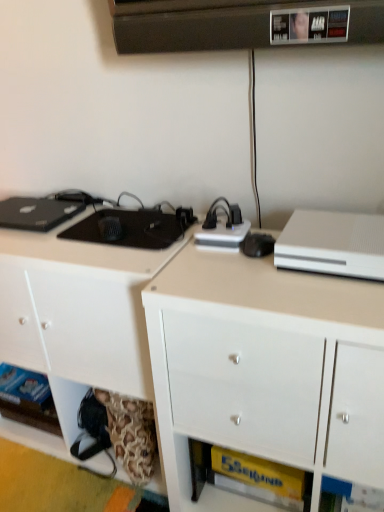
Question: Which direction should I rotate to face white glossy cabinet at center, marked as the first cabinetry in a right-to-left arrangement, — up or down?

Choices:
 (A) up
 (B) down

Answer: (B)

Question: Can you confirm if white matte cabinet at lower left, the 2th cabinetry positioned from the right, is wider than white matte desktop computer at upper right?

Choices:
 (A) no
 (B) yes

Answer: (B)

Question: From a real-world perspective, is white matte cabinet at lower left, the 2th cabinetry positioned from the right, beneath white matte desktop computer at upper right?

Choices:
 (A) no
 (B) yes

Answer: (B)

Question: Does white matte cabinet at lower left, the 2th cabinetry positioned from the right, lie in front of white matte desktop computer at upper right?

Choices:
 (A) no
 (B) yes

Answer: (A)

Question: Is white matte cabinet at lower left, the 2th cabinetry positioned from the right, taller than white matte desktop computer at upper right?

Choices:
 (A) yes
 (B) no

Answer: (A)

Question: Does white matte cabinet at lower left, which ranks as the first cabinetry in left-to-right order, turn towards white matte desktop computer at upper right?

Choices:
 (A) no
 (B) yes

Answer: (A)

Question: Is white matte cabinet at lower left, which ranks as the first cabinetry in left-to-right order, touching white matte desktop computer at upper right?

Choices:
 (A) yes
 (B) no

Answer: (B)

Question: Does white glossy cabinet at center, marked as the first cabinetry in a right-to-left arrangement, have a smaller size compared to white matte cabinet at lower left, which ranks as the first cabinetry in left-to-right order?

Choices:
 (A) yes
 (B) no

Answer: (A)

Question: Is white glossy cabinet at center, placed as the second cabinetry when sorted from left to right, oriented away from white matte cabinet at lower left, the 2th cabinetry positioned from the right?

Choices:
 (A) no
 (B) yes

Answer: (A)

Question: Is white glossy cabinet at center, placed as the second cabinetry when sorted from left to right, shorter than white matte cabinet at lower left, which ranks as the first cabinetry in left-to-right order?

Choices:
 (A) no
 (B) yes

Answer: (A)

Question: Is white glossy cabinet at center, marked as the first cabinetry in a right-to-left arrangement, not near white matte cabinet at lower left, which ranks as the first cabinetry in left-to-right order?

Choices:
 (A) no
 (B) yes

Answer: (A)

Question: Is white glossy cabinet at center, placed as the second cabinetry when sorted from left to right, to the right of white matte cabinet at lower left, which ranks as the first cabinetry in left-to-right order, from the viewer's perspective?

Choices:
 (A) no
 (B) yes

Answer: (B)

Question: Is white glossy cabinet at center, placed as the second cabinetry when sorted from left to right, positioned behind white matte cabinet at lower left, the 2th cabinetry positioned from the right?

Choices:
 (A) no
 (B) yes

Answer: (A)

Question: Is white matte cabinet at lower left, which ranks as the first cabinetry in left-to-right order, taller than white glossy cabinet at center, placed as the second cabinetry when sorted from left to right?

Choices:
 (A) yes
 (B) no

Answer: (B)